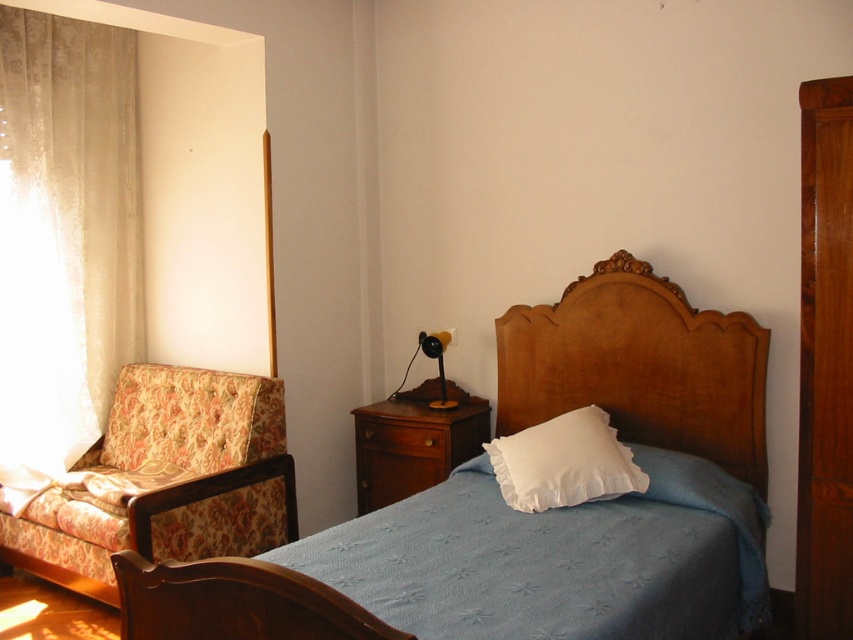
Question: Which of the following is the closest to the observer?

Choices:
 (A) brown wood/dark wood dresser at center
 (B) blue textured blanket at center
 (C) wooden headboard at center
 (D) floral fabric armchair at left

Answer: (B)

Question: Which point appears farthest from the camera in this image?

Choices:
 (A) (488, 490)
 (B) (364, 440)
 (C) (260, 438)

Answer: (B)

Question: Which object appears closest to the camera in this image?

Choices:
 (A) blue textured blanket at center
 (B) wooden dresser at center

Answer: (A)

Question: Does wooden bed at center come behind floral fabric armchair at left?

Choices:
 (A) yes
 (B) no

Answer: (A)

Question: Is wooden headboard at center in front of brown wood drawer at lower center?

Choices:
 (A) no
 (B) yes

Answer: (B)

Question: Can you confirm if blue textured blanket at center is positioned to the right of wooden bed at center?

Choices:
 (A) yes
 (B) no

Answer: (B)